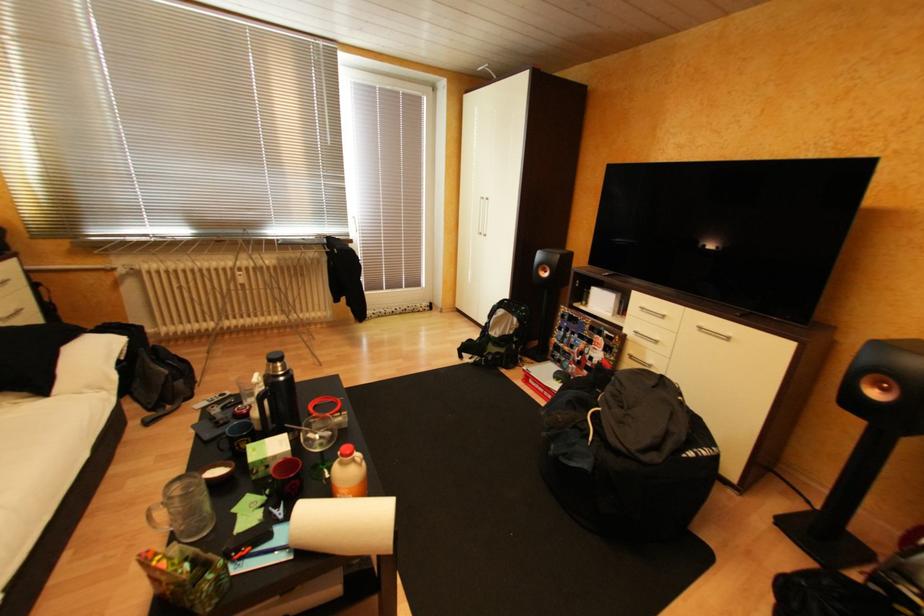
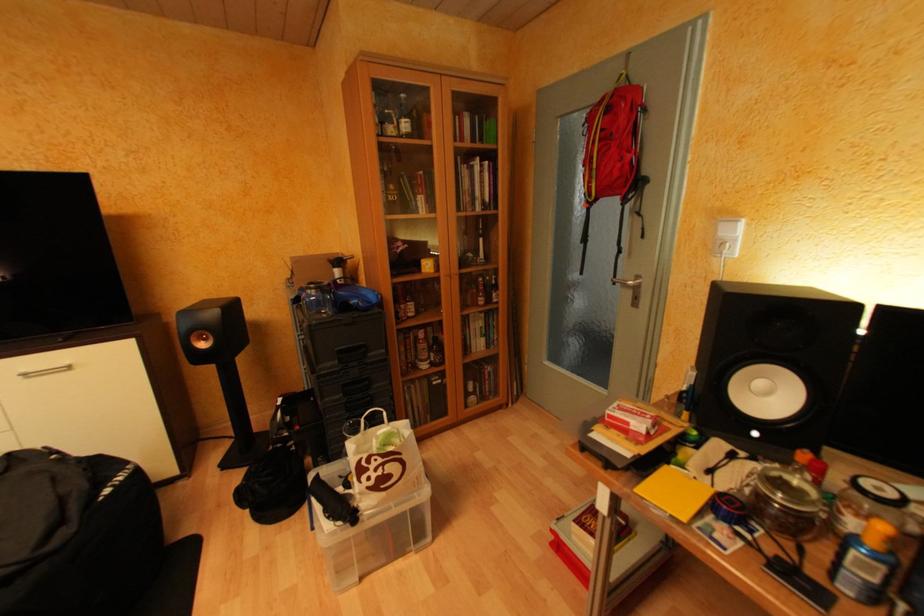
The images are taken continuously from a first-person perspective. In which direction is your viewpoint rotating?

The rotation direction of the camera is right-down.